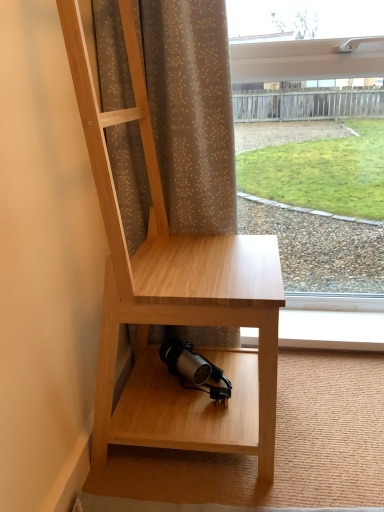
I want to click on transparent glass window at upper right, so click(x=303, y=42).

Find the location of a particular element. This screenshot has height=512, width=384. natural wood desk at center is located at coordinates (175, 298).

Locate an element on the screen. brown sheer curtain at upper center is located at coordinates (191, 110).

Is brown sheer curtain at upper center looking in the opposite direction of transparent glass window at upper right?

No, brown sheer curtain at upper center's orientation is not away from transparent glass window at upper right.

Does brown sheer curtain at upper center have a greater height compared to transparent glass window at upper right?

In fact, brown sheer curtain at upper center may be shorter than transparent glass window at upper right.

Would you say brown sheer curtain at upper center is to the left or to the right of transparent glass window at upper right in the picture?

brown sheer curtain at upper center is to the left of transparent glass window at upper right.

Measure the distance from brown sheer curtain at upper center to transparent glass window at upper right.

brown sheer curtain at upper center is 46.14 centimeters from transparent glass window at upper right.

From the picture: Which of these two, transparent glass window at upper right or natural wood desk at center, is smaller?

With smaller size is transparent glass window at upper right.

How far apart are transparent glass window at upper right and natural wood desk at center?

32.56 inches.

From their relative heights in the image, would you say transparent glass window at upper right is taller or shorter than natural wood desk at center?

In the image, transparent glass window at upper right appears to be taller than natural wood desk at center.

You are a GUI agent. You are given a task and a screenshot of the screen. Output one action in this format:
    pyautogui.click(x=<x>, y=<y>)
    Task: Click on the window located behind the natural wood desk at center
    
    Given the screenshot: What is the action you would take?
    pyautogui.click(x=303, y=42)

Is natural wood desk at center at the back of brown sheer curtain at upper center?

Yes, brown sheer curtain at upper center is positioned with its back facing natural wood desk at center.

From the image's perspective, which one is positioned lower, brown sheer curtain at upper center or natural wood desk at center?

A: natural wood desk at center, from the image's perspective.

Is point (172, 170) positioned in front of point (220, 315)?

No, (172, 170) is further to viewer.

Which object is further away from the camera, brown sheer curtain at upper center or natural wood desk at center?

Positioned behind is brown sheer curtain at upper center.

Who is shorter, transparent glass window at upper right or brown sheer curtain at upper center?

With less height is brown sheer curtain at upper center.

Is transparent glass window at upper right oriented towards brown sheer curtain at upper center?

No.

Considering the relative sizes of transparent glass window at upper right and brown sheer curtain at upper center in the image provided, is transparent glass window at upper right thinner than brown sheer curtain at upper center?

Indeed, transparent glass window at upper right has a lesser width compared to brown sheer curtain at upper center.

Find the location of a particular element. window behind the brown sheer curtain at upper center is located at coordinates point(303,42).

Is natural wood desk at center not within brown sheer curtain at upper center?

Indeed, natural wood desk at center is completely outside brown sheer curtain at upper center.

Can you see natural wood desk at center touching brown sheer curtain at upper center?

No, natural wood desk at center is not touching brown sheer curtain at upper center.

Is natural wood desk at center to the right of brown sheer curtain at upper center from the viewer's perspective?

Indeed, natural wood desk at center is positioned on the right side of brown sheer curtain at upper center.

From the image's perspective, is natural wood desk at center above brown sheer curtain at upper center?

No, from the image's perspective, natural wood desk at center is not above brown sheer curtain at upper center.

Considering the positions of points (150, 402) and (293, 52), is point (150, 402) closer to camera compared to point (293, 52)?

That is True.

From the image's perspective, between natural wood desk at center and transparent glass window at upper right, who is located below?

natural wood desk at center appears lower in the image.

Considering the relative sizes of natural wood desk at center and transparent glass window at upper right in the image provided, is natural wood desk at center taller than transparent glass window at upper right?

No, natural wood desk at center is not taller than transparent glass window at upper right.

Looking at the image, does natural wood desk at center seem bigger or smaller compared to transparent glass window at upper right?

In the image, natural wood desk at center appears to be larger than transparent glass window at upper right.

Where is `curtain that is in front of the transparent glass window at upper right`? curtain that is in front of the transparent glass window at upper right is located at coordinates (191, 110).

You are a GUI agent. You are given a task and a screenshot of the screen. Output one action in this format:
    pyautogui.click(x=<x>, y=<y>)
    Task: Click on the furniture below the transparent glass window at upper right (from a real-world perspective)
    
    Given the screenshot: What is the action you would take?
    pyautogui.click(x=175, y=298)

Looking at the image, which one is located closer to brown sheer curtain at upper center, transparent glass window at upper right or natural wood desk at center?

natural wood desk at center is closer to brown sheer curtain at upper center.

Based on their spatial positions, is natural wood desk at center or brown sheer curtain at upper center further from transparent glass window at upper right?

natural wood desk at center is positioned further to the anchor transparent glass window at upper right.

When comparing their distances from natural wood desk at center, does transparent glass window at upper right or brown sheer curtain at upper center seem closer?

brown sheer curtain at upper center is positioned closer to the anchor natural wood desk at center.

When comparing their distances from natural wood desk at center, does brown sheer curtain at upper center or transparent glass window at upper right seem closer?

Based on the image, brown sheer curtain at upper center appears to be nearer to natural wood desk at center.

Which object lies nearer to the anchor point transparent glass window at upper right, brown sheer curtain at upper center or natural wood desk at center?

brown sheer curtain at upper center is closer to transparent glass window at upper right.

Based on their spatial positions, is natural wood desk at center or transparent glass window at upper right closer to brown sheer curtain at upper center?

natural wood desk at center.

Locate an element on the screen. curtain between natural wood desk at center and transparent glass window at upper right in the front-back direction is located at coordinates (191, 110).